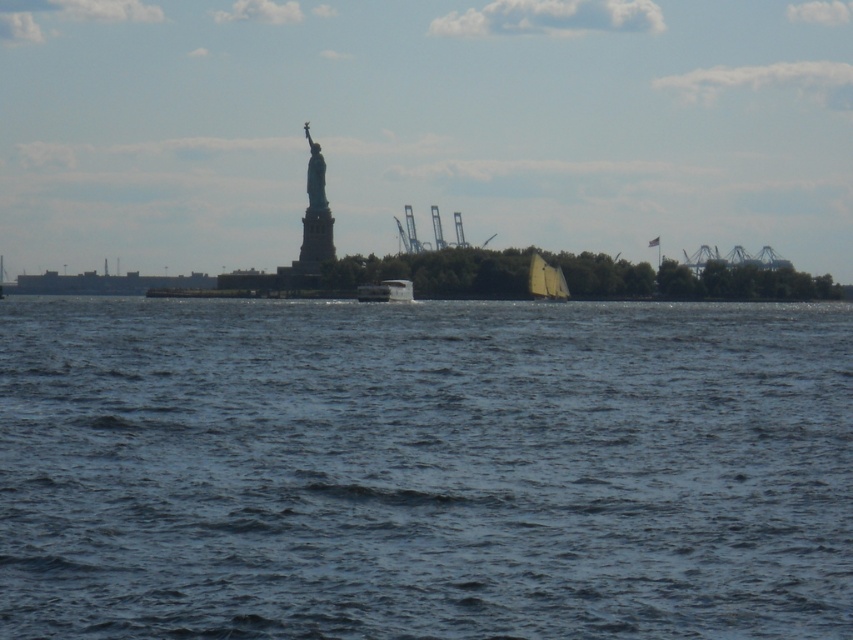
Question: Can you confirm if white sailboat at center is thinner than polished metal statue at upper center?

Choices:
 (A) no
 (B) yes

Answer: (A)

Question: Based on their relative distances, which object is farther from the polished metal statue at upper center?

Choices:
 (A) metallic statue at upper center
 (B) white glossy boat at center
 (C) white sailboat at center
 (D) blue water at center

Answer: (D)

Question: Does white sailboat at center have a smaller size compared to white glossy boat at center?

Choices:
 (A) no
 (B) yes

Answer: (B)

Question: Among these objects, which one is farthest from the camera?

Choices:
 (A) white glossy boat at center
 (B) blue water at center

Answer: (A)

Question: Estimate the real-world distances between objects in this image. Which object is farther from the blue water at center?

Choices:
 (A) metallic statue at upper center
 (B) white sailboat at center

Answer: (A)

Question: Does blue water at center appear on the right side of polished metal statue at upper center?

Choices:
 (A) yes
 (B) no

Answer: (A)